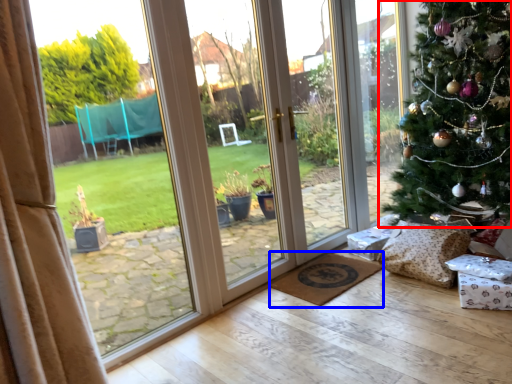
Question: Which of the following is the closest to the observer, christmas tree (highlighted by a red box) or doormat (highlighted by a blue box)?

Choices:
 (A) christmas tree
 (B) doormat

Answer: (A)